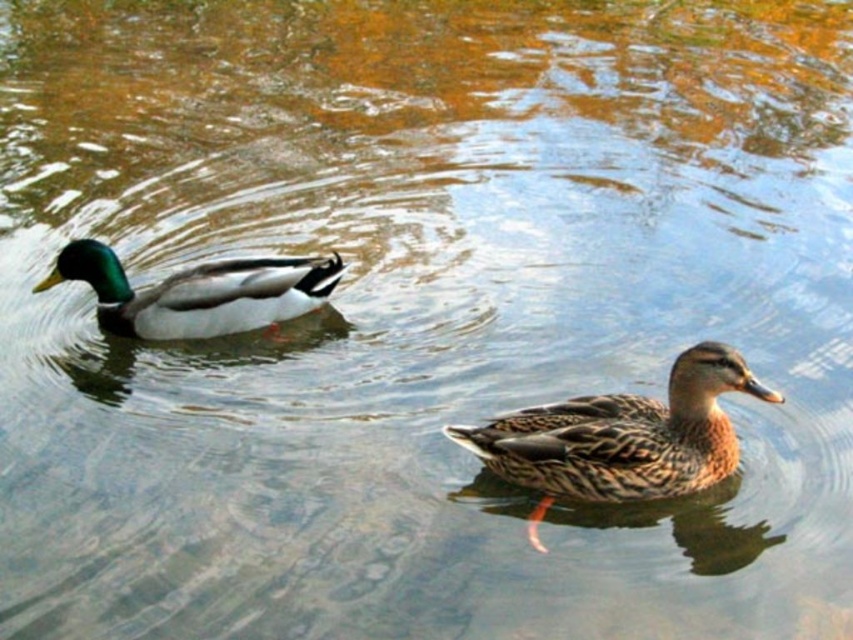
You are observing two ducks in a pond. The brown speckled duck at center and the shiny green and white duck at left are both swimming. Which duck is bigger?

The brown speckled duck at center is larger in size compared to the shiny green and white duck at left.

You are a wildlife photographer aiming to capture both the brown speckled duck at center and the shiny green and white duck at left in a single shot. Your camera has a maximum focal length that allows capturing objects up to 8 feet apart. Can you include both ducks in the frame without moving the camera?

The distance between the brown speckled duck at center and the shiny green and white duck at left is 7.76 feet, which is within the camera maximum focal length of 8 feet. Therefore, you can include both ducks in the frame without moving the camera.

You are standing at the edge of the pond and see two points marked on the water surface. The first point is at coordinates point (711,349) and the second point is at point (111,262). Which point is closer to you?

Point (711,349) is in front of point (111,262), so it is closer to you.